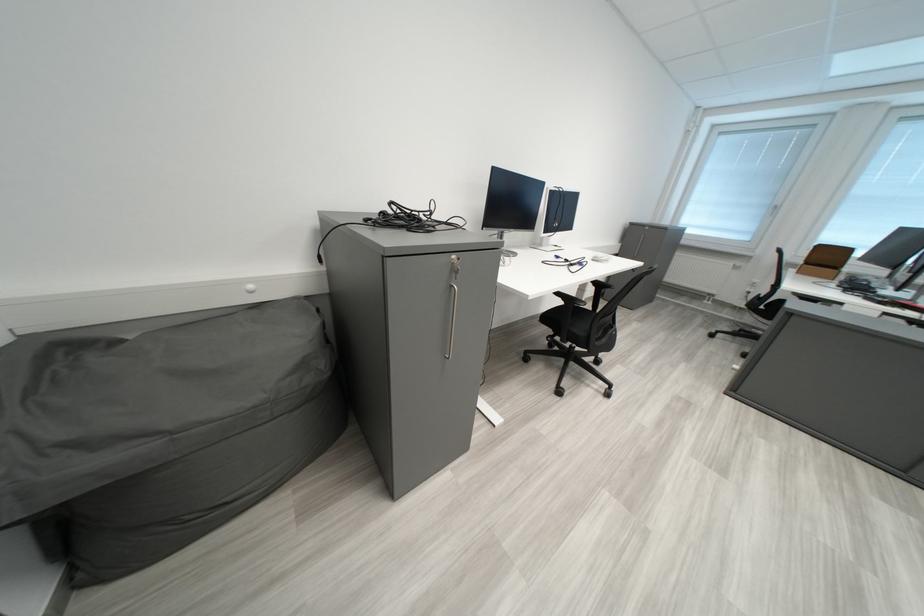
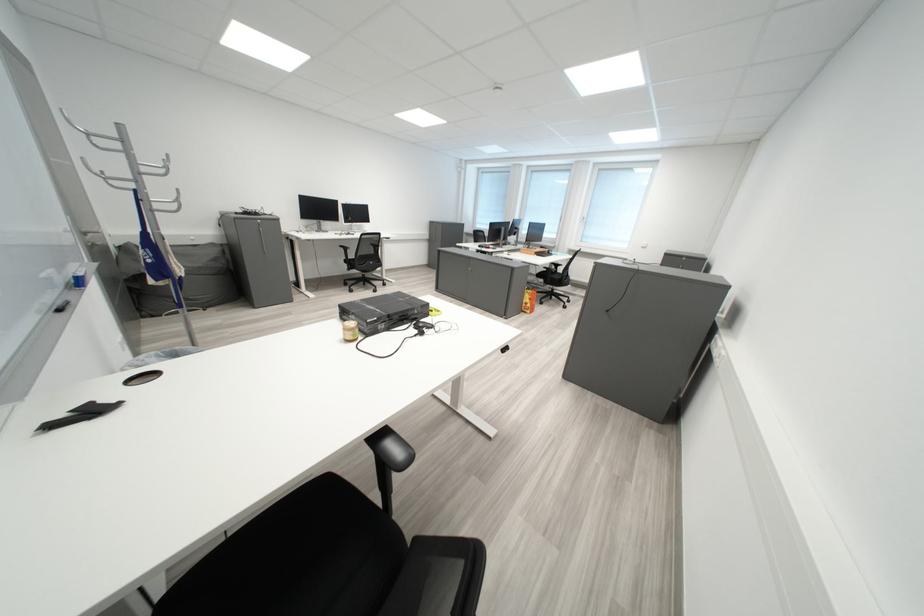
Locate, in the second image, the point that corresponds to the point at 315,368 in the first image.

(228, 262)